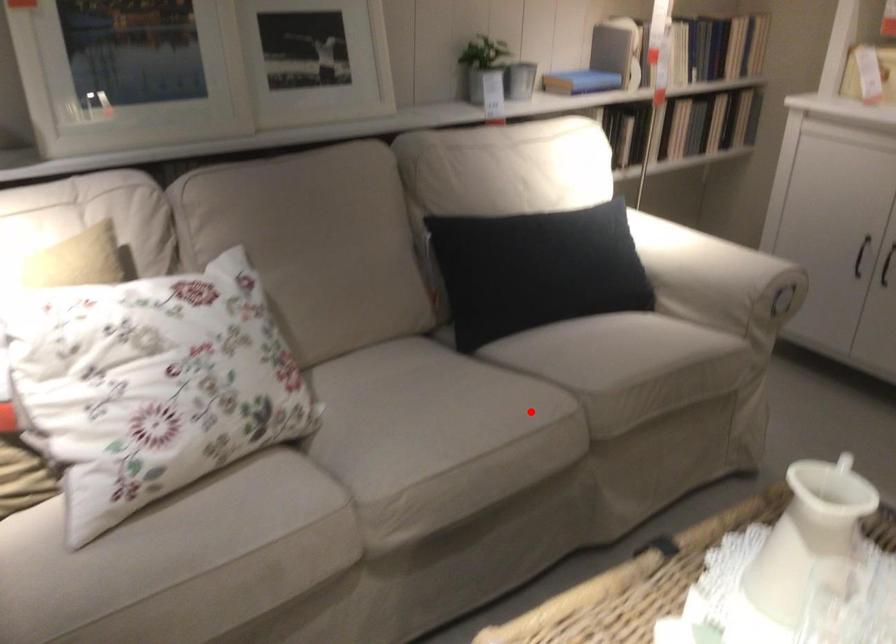
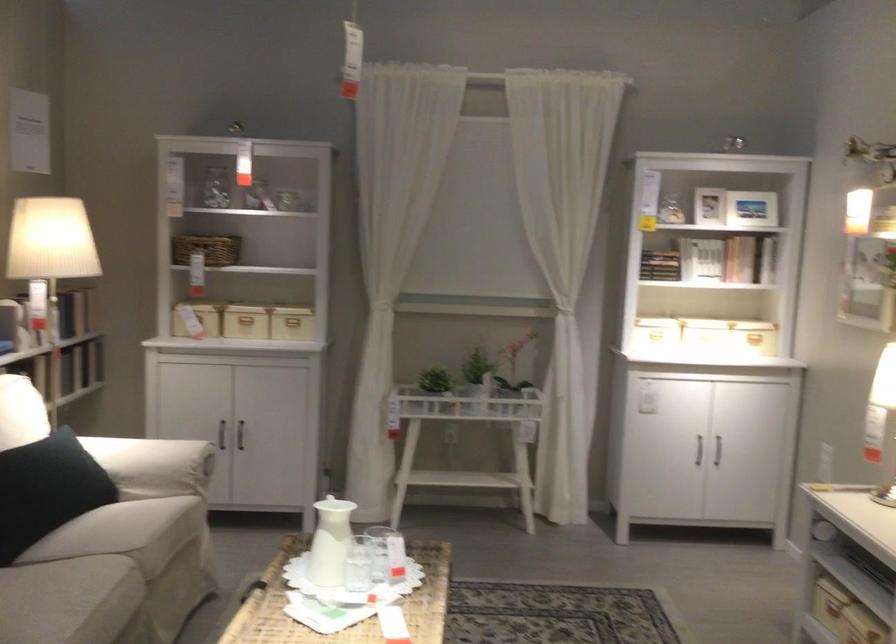
Where in the second image is the point corresponding to the highlighted location from the first image?

(110, 576)